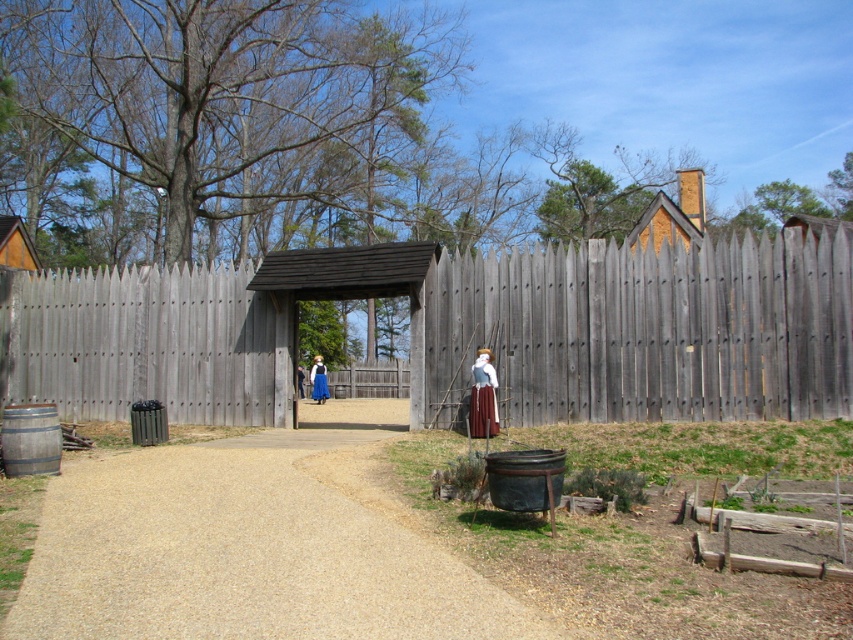
Question: Which point is closer to the camera taking this photo?

Choices:
 (A) pyautogui.click(x=300, y=396)
 (B) pyautogui.click(x=477, y=419)

Answer: (B)

Question: Can you confirm if gravel pathway at center is positioned to the left of blue fabric dress at center?

Choices:
 (A) yes
 (B) no

Answer: (B)

Question: Based on their relative distances, which object is farther from the gray wooden fence at center?

Choices:
 (A) blue fabric dress at center
 (B) blue cotton dress at center

Answer: (B)

Question: Observing the image, what is the correct spatial positioning of gravel pathway at center in reference to brown leather skirt at center?

Choices:
 (A) right
 (B) left

Answer: (B)

Question: Is gray wooden fence at center further to camera compared to blue fabric dress at center?

Choices:
 (A) yes
 (B) no

Answer: (B)

Question: Estimate the real-world distances between objects in this image. Which object is farther from the gravel pathway at center?

Choices:
 (A) wooden hut at left
 (B) gray wooden fence at center
 (C) wooden barrel at lower left
 (D) brown leather skirt at center

Answer: (A)